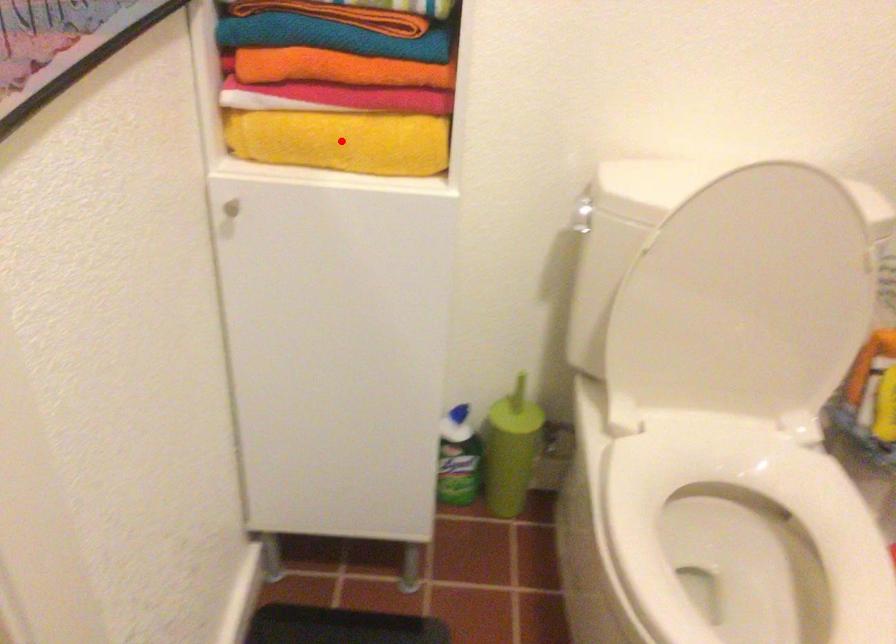
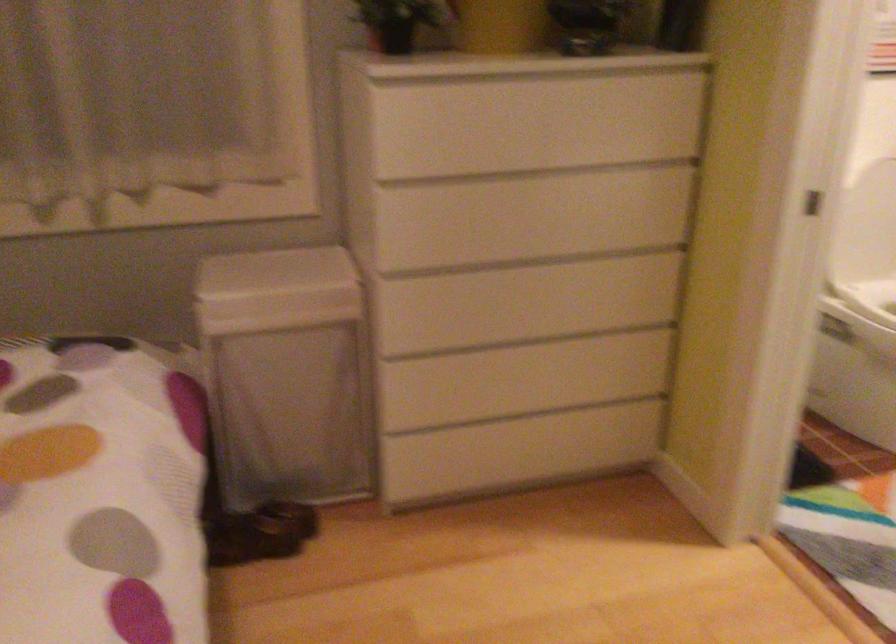
Question: I am providing you with two images of the same scene from different viewpoints. A red point is marked on the first image. Can you still see the location of the red point in image 2?

Choices:
 (A) Yes
 (B) No

Answer: (B)